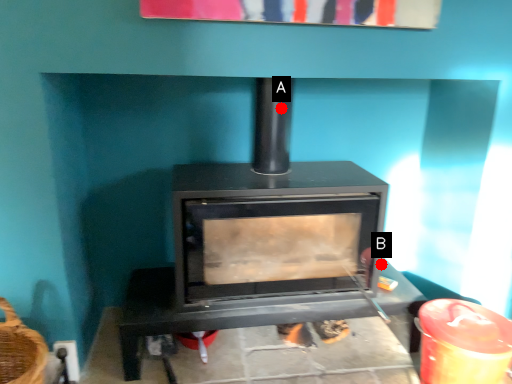
Question: Two points are circled on the image, labeled by A and B beside each circle. Among these points, which one is nearest to the camera?

Choices:
 (A) A is closer
 (B) B is closer

Answer: (A)